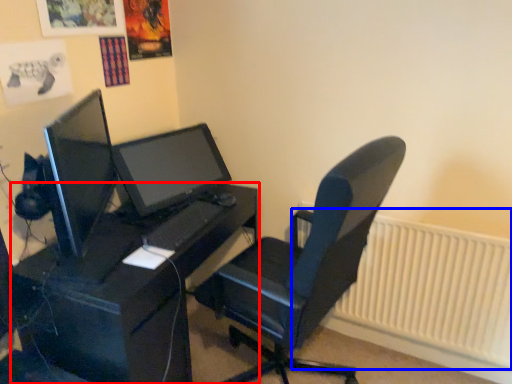
Question: Which point is further to the camera, desk (highlighted by a red box) or radiator (highlighted by a blue box)?

Choices:
 (A) desk
 (B) radiator

Answer: (B)